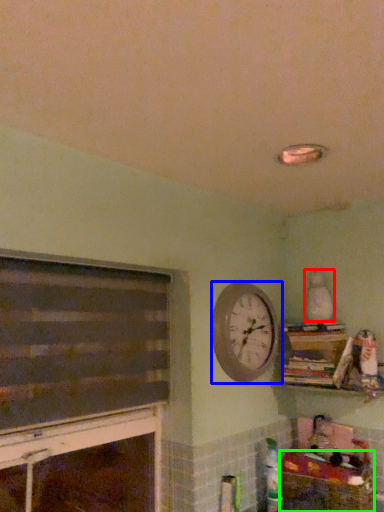
Question: Which object is positioned farthest from toy (highlighted by a red box)? Select from wall clock (highlighted by a blue box) and crate (highlighted by a green box).

Choices:
 (A) wall clock
 (B) crate

Answer: (B)